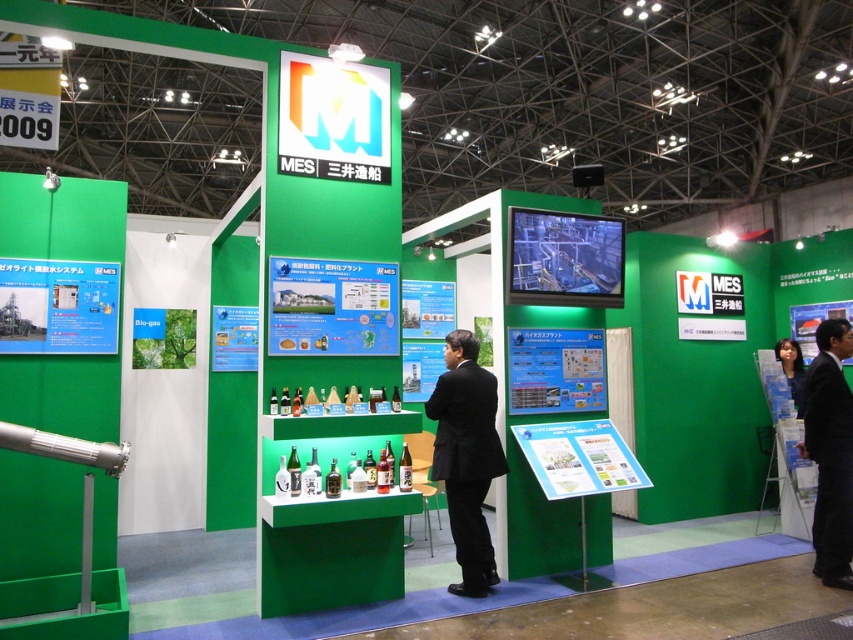
Who is more forward, (463, 333) or (778, 342)?

Positioned in front is point (463, 333).

Is black suit at center thinner than matte black hair at lower right?

No, black suit at center is not thinner than matte black hair at lower right.

Who is more forward, [445,340] or [790,394]?

Point [790,394] is more forward.

The image size is (853, 640). I want to click on black suit at center, so click(x=466, y=456).

Does black suit at center appear on the left side of black suit at right?

Indeed, black suit at center is positioned on the left side of black suit at right.

Which is in front, point (491, 404) or point (840, 513)?

Point (491, 404)

This screenshot has width=853, height=640. I want to click on black suit at center, so click(466, 456).

Is black suit at right taller than matte black hair at lower right?

Yes, black suit at right is taller than matte black hair at lower right.

Who is more distant from viewer, [811,390] or [799,406]?

Point [799,406]

Image resolution: width=853 pixels, height=640 pixels. I want to click on black suit at right, so click(830, 452).